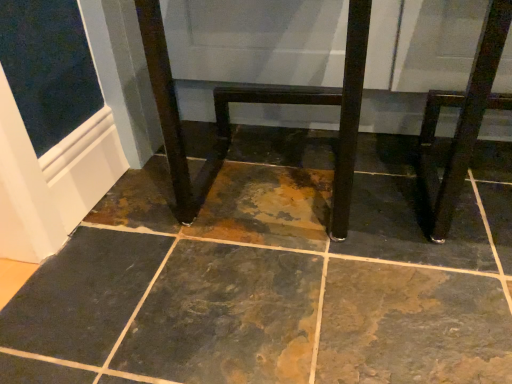
This screenshot has height=384, width=512. Describe the element at coordinates (256, 102) in the screenshot. I see `matte black table at center` at that location.

Find the location of a particular element. This screenshot has height=384, width=512. matte black table at center is located at coordinates (256, 102).

Looking at this image, measure the distance between shiny dark wood stool at right and camera.

shiny dark wood stool at right and camera are 22.79 inches apart from each other.

Locate an element on the screen. This screenshot has height=384, width=512. shiny dark wood stool at right is located at coordinates (462, 122).

The width and height of the screenshot is (512, 384). What do you see at coordinates (462, 122) in the screenshot?
I see `shiny dark wood stool at right` at bounding box center [462, 122].

Locate an element on the screen. matte black table at center is located at coordinates (256, 102).

Is matte black table at center to the left of shiny dark wood stool at right from the viewer's perspective?

Indeed, matte black table at center is positioned on the left side of shiny dark wood stool at right.

Based on the photo, is matte black table at center in front of or behind shiny dark wood stool at right in the image?

Clearly, matte black table at center is behind shiny dark wood stool at right.

Which point is more distant from viewer, [176,162] or [449,222]?

The point [176,162] is behind.

Looking at this image, from the image's perspective, which is above, matte black table at center or shiny dark wood stool at right?

From the image's view, matte black table at center is above.

From a real-world perspective, is matte black table at center physically below shiny dark wood stool at right?

Correct, in the physical world, matte black table at center is lower than shiny dark wood stool at right.

Is matte black table at center thinner than shiny dark wood stool at right?

No, matte black table at center is not thinner than shiny dark wood stool at right.

Does matte black table at center have a greater height compared to shiny dark wood stool at right?

Correct, matte black table at center is much taller as shiny dark wood stool at right.

Is matte black table at center smaller than shiny dark wood stool at right?

Actually, matte black table at center might be larger than shiny dark wood stool at right.

Can shiny dark wood stool at right be found inside matte black table at center?

Yes, shiny dark wood stool at right can be found within matte black table at center.

Is matte black table at center placed right next to shiny dark wood stool at right?

Yes, matte black table at center is right next to shiny dark wood stool at right and making contact.

Could you tell me if matte black table at center is turned towards shiny dark wood stool at right?

No, matte black table at center is not turned towards shiny dark wood stool at right.

Locate an element on the screen. The height and width of the screenshot is (384, 512). step stool positioned vertically above the matte black table at center (from a real-world perspective) is located at coordinates (462, 122).

Between shiny dark wood stool at right and matte black table at center, which one appears on the right side from the viewer's perspective?

shiny dark wood stool at right is more to the right.

Between shiny dark wood stool at right and matte black table at center, which one is positioned in front?

shiny dark wood stool at right is in front.

Which is in front, point (445, 227) or point (452, 200)?

Point (452, 200)

From the image's perspective, does shiny dark wood stool at right appear lower than matte black table at center?

Yes, from the image's perspective, shiny dark wood stool at right is beneath matte black table at center.

From a real-world perspective, is shiny dark wood stool at right above or below matte black table at center?

shiny dark wood stool at right is situated higher than matte black table at center in the real world.

Considering the sizes of objects shiny dark wood stool at right and matte black table at center in the image provided, who is thinner, shiny dark wood stool at right or matte black table at center?

With smaller width is shiny dark wood stool at right.

Which of these two, shiny dark wood stool at right or matte black table at center, stands shorter?

shiny dark wood stool at right is shorter.

Considering the sizes of objects shiny dark wood stool at right and matte black table at center in the image provided, who is smaller, shiny dark wood stool at right or matte black table at center?

shiny dark wood stool at right is smaller.

Is shiny dark wood stool at right situated inside matte black table at center or outside?

shiny dark wood stool at right lies within the bounds of matte black table at center.

Does shiny dark wood stool at right touch matte black table at center?

Yes, shiny dark wood stool at right is next to matte black table at center.

Is shiny dark wood stool at right looking in the opposite direction of matte black table at center?

Yes, matte black table at center is at the back of shiny dark wood stool at right.

The width and height of the screenshot is (512, 384). Find the location of `step stool positioned vertically above the matte black table at center (from a real-world perspective)`. step stool positioned vertically above the matte black table at center (from a real-world perspective) is located at coordinates (462, 122).

Find the location of a particular element. step stool lying on the right of matte black table at center is located at coordinates (462, 122).

Locate an element on the screen. This screenshot has width=512, height=384. furniture on the left of shiny dark wood stool at right is located at coordinates (256, 102).